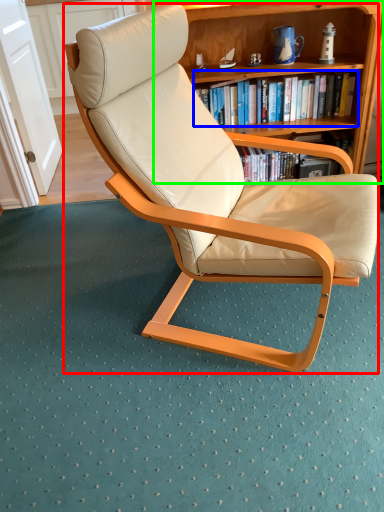
Question: Which object is the farthest from chair (highlighted by a red box)? Choose among these: book (highlighted by a blue box) or bookcase (highlighted by a green box).

Choices:
 (A) book
 (B) bookcase

Answer: (A)